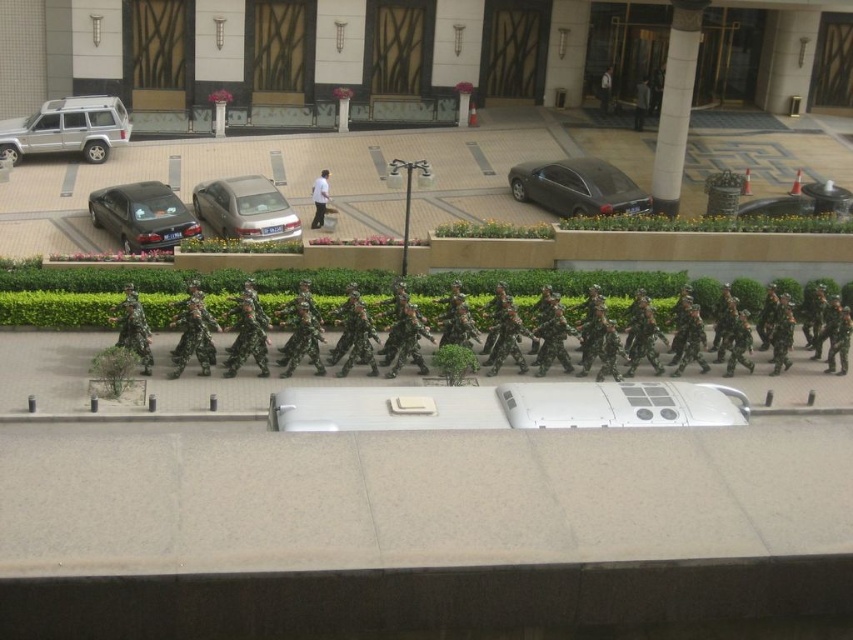
Question: Does shiny black sedan at left come in front of silver metallic sedan at center?

Choices:
 (A) yes
 (B) no

Answer: (A)

Question: Can you confirm if camouflage fabric soldiers at center is positioned to the right of silver metallic suv at upper left?

Choices:
 (A) yes
 (B) no

Answer: (A)

Question: Which point appears closest to the camera in this image?

Choices:
 (A) (99, 100)
 (B) (143, 196)

Answer: (B)

Question: Which object is positioned farthest from the silver metallic sedan at center?

Choices:
 (A) silver metallic suv at upper left
 (B) satin black sedan at center
 (C) shiny black sedan at left

Answer: (B)

Question: Is camouflage fabric soldiers at center closer to the viewer compared to shiny black sedan at left?

Choices:
 (A) yes
 (B) no

Answer: (A)

Question: Which of these objects is positioned farthest from the silver metallic suv at upper left?

Choices:
 (A) camouflage fabric soldiers at center
 (B) silver metallic sedan at center
 (C) shiny black sedan at left
 (D) satin black sedan at center

Answer: (D)